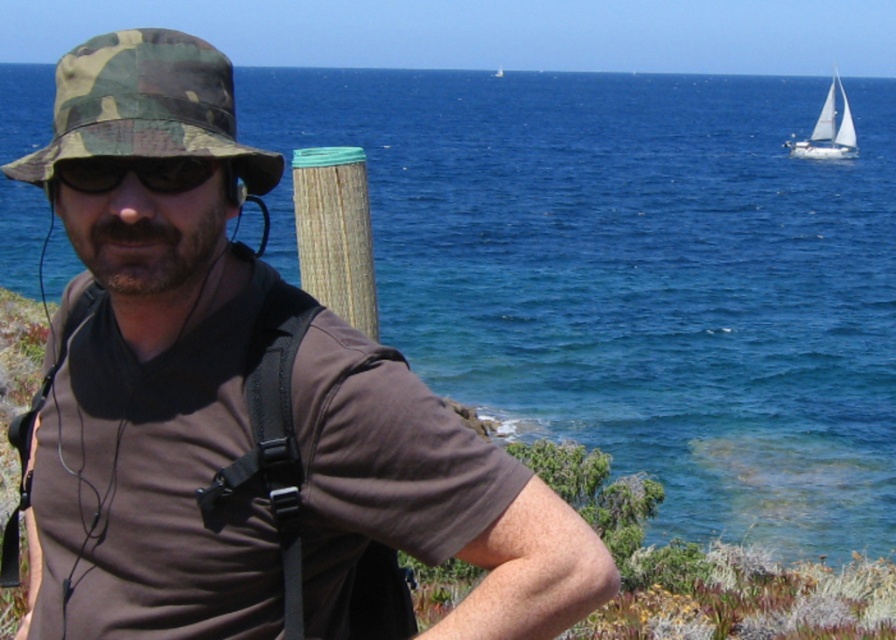
Can you confirm if camo fabric hat at upper left is bigger than white sailboat at upper right?

Incorrect, camo fabric hat at upper left is not larger than white sailboat at upper right.

In the scene shown: Does camo fabric hat at upper left have a smaller size compared to white sailboat at upper right?

Yes.

You are a GUI agent. You are given a task and a screenshot of the screen. Output one action in this format:
    pyautogui.click(x=<x>, y=<y>)
    Task: Click on the camo fabric hat at upper left
    Image resolution: width=896 pixels, height=640 pixels.
    Given the screenshot: What is the action you would take?
    pyautogui.click(x=145, y=106)

Which is more to the left, brown matte shirt at center or white sailboat at upper right?

brown matte shirt at center is more to the left.

Is brown matte shirt at center to the left of white sailboat at upper right from the viewer's perspective?

Indeed, brown matte shirt at center is positioned on the left side of white sailboat at upper right.

Where is `brown matte shirt at center`? brown matte shirt at center is located at coordinates (243, 413).

Which is above, camo fabric hat at upper left or black matte sunglasses at center?

camo fabric hat at upper left is above.

Who is positioned more to the left, camo fabric hat at upper left or black matte sunglasses at center?

camo fabric hat at upper left

Image resolution: width=896 pixels, height=640 pixels. Find the location of `camo fabric hat at upper left`. camo fabric hat at upper left is located at coordinates (145, 106).